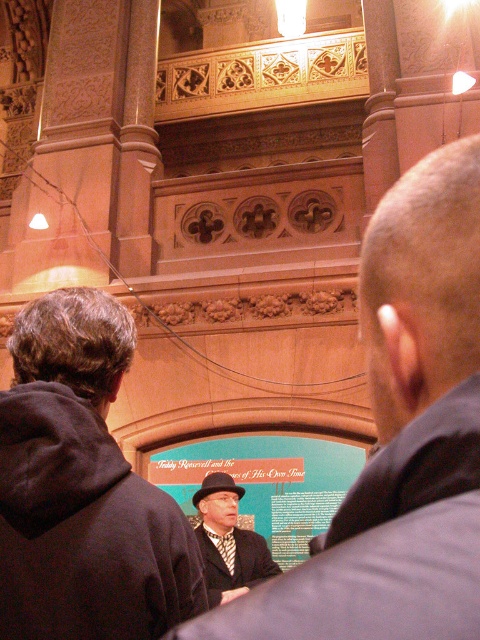
You are standing in the historical institution and want to read the teal matte signboard at center. There is a dark gray hoodie at center blocking your view. Can you see the signboard clearly?

The dark gray hoodie at center is above the teal matte signboard at center, so the signboard is partially visible below the hoodie.